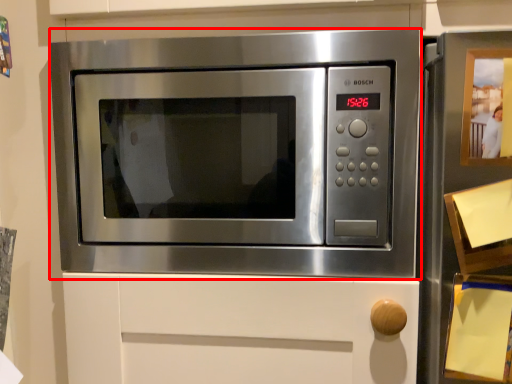
Question: From the image's perspective, what is the correct spatial relationship of microwave oven (annotated by the red box) in relation to button?

Choices:
 (A) above
 (B) below

Answer: (B)